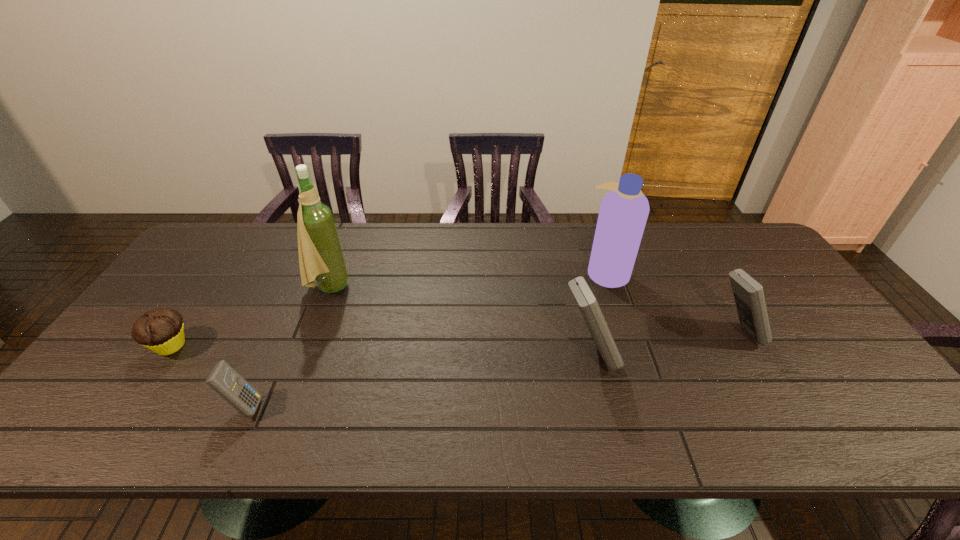
Please point a location where one more calculator can be added evenly. Please provide its 2D coordinates. Your answer should be formatted as a tuple, i.e. [(x, y)], where the tuple contains the x and y coordinates of a point satisfying the conditions above.

[(425, 380)]